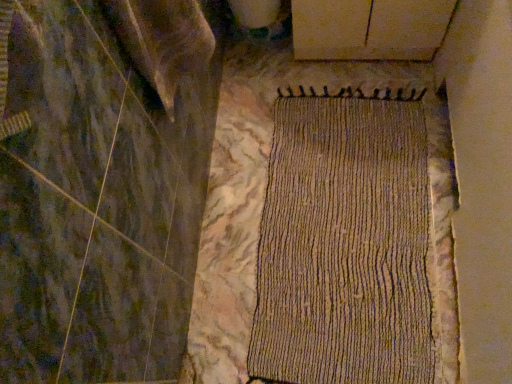
Question: Could you tell me if woven beige mat at center is facing smooth white plywood at upper center?

Choices:
 (A) no
 (B) yes

Answer: (A)

Question: Does woven beige mat at center have a lesser height compared to smooth white plywood at upper center?

Choices:
 (A) yes
 (B) no

Answer: (A)

Question: Considering the relative sizes of woven beige mat at center and smooth white plywood at upper center in the image provided, is woven beige mat at center thinner than smooth white plywood at upper center?

Choices:
 (A) yes
 (B) no

Answer: (B)

Question: Is woven beige mat at center next to smooth white plywood at upper center and touching it?

Choices:
 (A) no
 (B) yes

Answer: (A)

Question: Can you confirm if woven beige mat at center is bigger than smooth white plywood at upper center?

Choices:
 (A) no
 (B) yes

Answer: (A)

Question: From a real-world perspective, is woven beige mat at center over smooth white plywood at upper center?

Choices:
 (A) no
 (B) yes

Answer: (A)

Question: Is smooth white plywood at upper center in contact with woven beige mat at center?

Choices:
 (A) yes
 (B) no

Answer: (B)

Question: Is smooth white plywood at upper center far from woven beige mat at center?

Choices:
 (A) yes
 (B) no

Answer: (B)

Question: Is smooth white plywood at upper center not inside woven beige mat at center?

Choices:
 (A) no
 (B) yes

Answer: (B)

Question: Is smooth white plywood at upper center at the left side of woven beige mat at center?

Choices:
 (A) no
 (B) yes

Answer: (A)

Question: From the image's perspective, would you say smooth white plywood at upper center is shown under woven beige mat at center?

Choices:
 (A) no
 (B) yes

Answer: (A)

Question: Is smooth white plywood at upper center thinner than woven beige mat at center?

Choices:
 (A) no
 (B) yes

Answer: (B)

Question: From a real-world perspective, relative to smooth white plywood at upper center, is woven beige mat at center vertically above or below?

Choices:
 (A) below
 (B) above

Answer: (A)